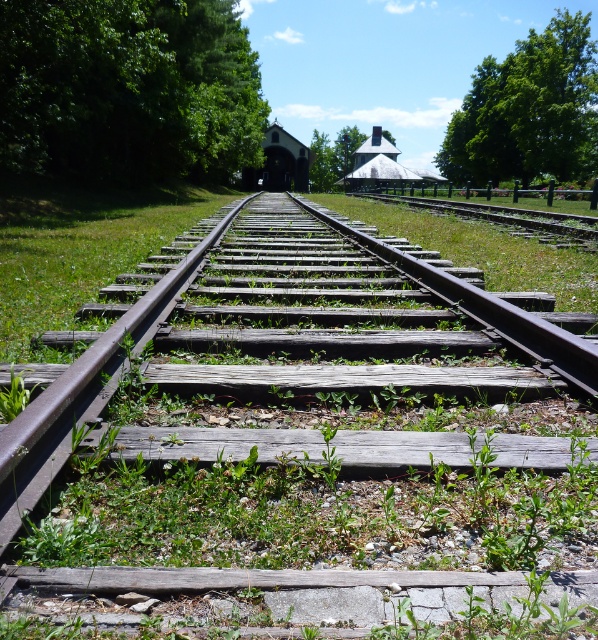
You are a photographer planning to take a wide shot of the weathered wood train track at center and the green leafy tree at upper right. Which object will appear smaller in the photo?

The weathered wood train track at center will appear smaller in the photo because it has a smaller size compared to the green leafy tree at upper right.

You are standing at the point where the tracks begin and want to take a photo of the small structure at the end of the tracks. There is a green leafy tree at upper left marked by point (129, 90). Will this tree block your view of the structure?

The green leafy tree at upper left is located at point (129, 90), which is positioned above and to the left of the structure. This means the tree will not block your view of the structure as it is placed away from the direct line of sight towards the structure.